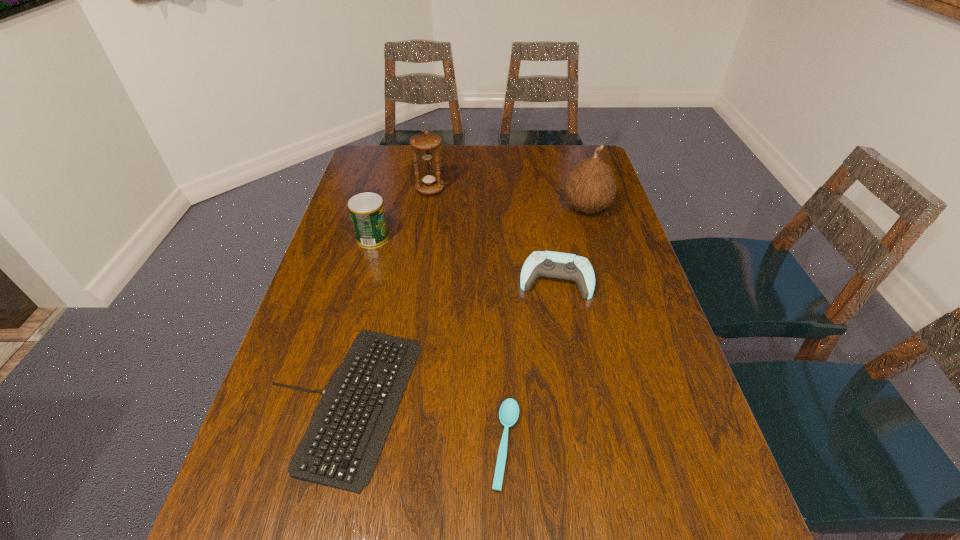
Identify the location of free spot between the shortest object and the coconut. This screenshot has height=540, width=960. (546, 326).

Image resolution: width=960 pixels, height=540 pixels. I want to click on vacant area that lies between the fifth shortest object and the computer keyboard, so click(x=385, y=296).

Locate an element on the screen. free space between the tallest object and the control is located at coordinates (570, 244).

Locate an element on the screen. The width and height of the screenshot is (960, 540). free spot between the control and the hourglass is located at coordinates (492, 234).

Where is `free space between the can and the fourth farthest object`? This screenshot has width=960, height=540. free space between the can and the fourth farthest object is located at coordinates (464, 259).

Locate an element on the screen. The width and height of the screenshot is (960, 540). object that is the third closest to the second shortest object is located at coordinates (367, 213).

Locate an element on the screen. This screenshot has height=540, width=960. the closest object relative to the computer keyboard is located at coordinates (509, 411).